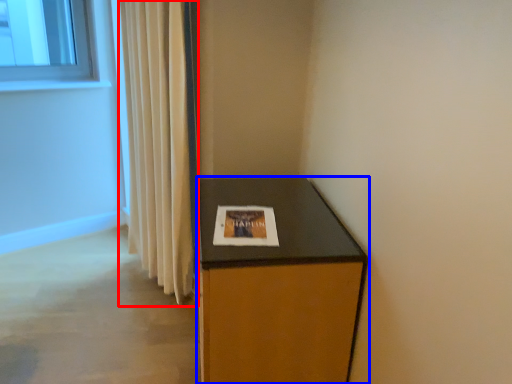
Question: Which point is further to the camera, curtain (highlighted by a red box) or furniture (highlighted by a blue box)?

Choices:
 (A) curtain
 (B) furniture

Answer: (A)